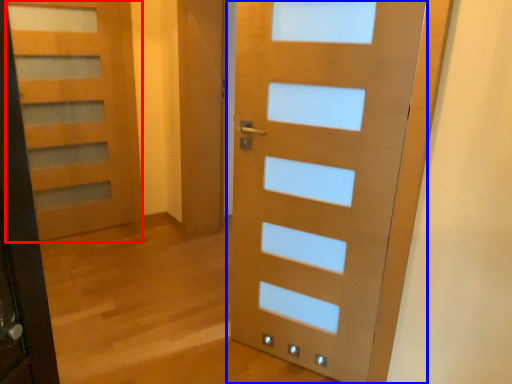
Question: Among these objects, which one is farthest to the camera, door (highlighted by a red box) or door (highlighted by a blue box)?

Choices:
 (A) door
 (B) door

Answer: (A)